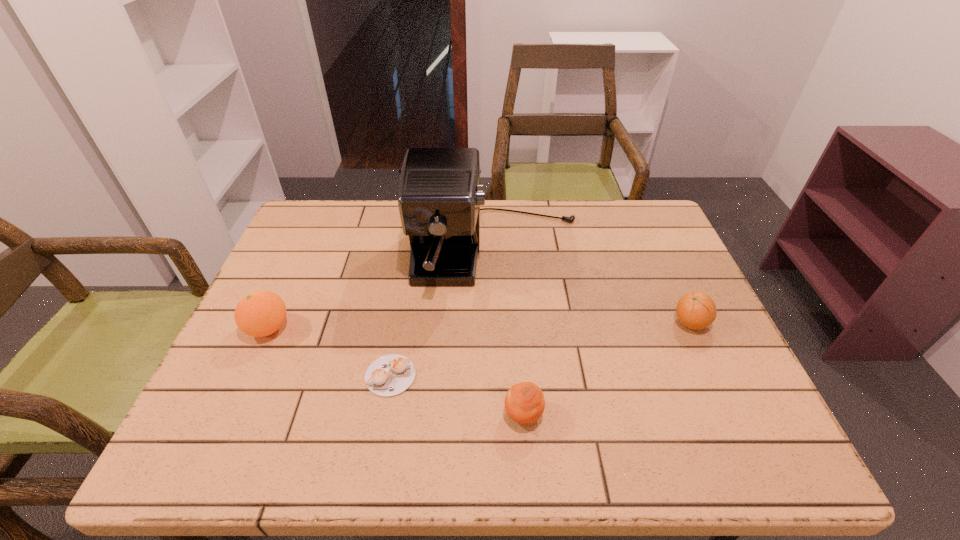
Locate which object is the fourth closest to the second orange from right to left. Please provide its 2D coordinates. Your answer should be formatted as a tuple, i.e. [(x, y)], where the tuple contains the x and y coordinates of a point satisfying the conditions above.

[(261, 313)]

Locate which object ranks third in proximity to the second tallest object. Please provide its 2D coordinates. Your answer should be formatted as a tuple, i.e. [(x, y)], where the tuple contains the x and y coordinates of a point satisfying the conditions above.

[(524, 402)]

Find the location of `the closest orange to the tallest object`. the closest orange to the tallest object is located at coordinates coord(696,310).

The width and height of the screenshot is (960, 540). In order to click on orange that is the closest to the rightmost orange in this screenshot , I will do `click(524, 402)`.

Identify the location of free spot that satisfies the following two spatial constraints: 1. on the front-facing side of the rightmost orange; 2. on the left side of the tallest object. [499, 322].

Locate an element on the screen. free point that satisfies the following two spatial constraints: 1. on the front side of the second orange from right to left; 2. on the right side of the tallest orange is located at coordinates 228,415.